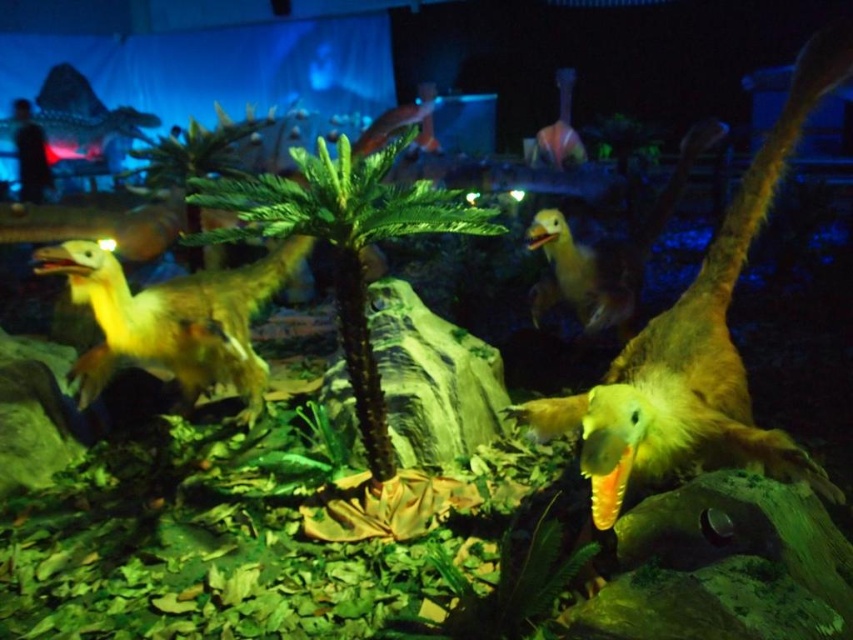
What do you see at coordinates (695, 344) in the screenshot?
I see `yellow matte dinosaur at center` at bounding box center [695, 344].

Does point (654, 387) come in front of point (180, 321)?

That is True.

Identify the location of yellow matte dinosaur at center. (695, 344).

Locate an element on the screen. The height and width of the screenshot is (640, 853). yellow matte dinosaur at center is located at coordinates (695, 344).

Does point (196, 237) come closer to viewer compared to point (125, 324)?

Yes, it is in front of point (125, 324).

You are a GUI agent. You are given a task and a screenshot of the screen. Output one action in this format:
    pyautogui.click(x=<x>, y=<y>)
    Task: Click on the green leafy palm tree at center
    This screenshot has width=853, height=640.
    Given the screenshot: What is the action you would take?
    [344, 243]

Who is higher up, yellow matte dinosaur at center or green leafy palm tree at center?

Positioned higher is green leafy palm tree at center.

Is yellow matte dinosaur at center thinner than green leafy palm tree at center?

Yes, yellow matte dinosaur at center is thinner than green leafy palm tree at center.

Is point (805, 80) in front of point (434, 208)?

Yes, point (805, 80) is closer to viewer.

The image size is (853, 640). Find the location of `yellow matte dinosaur at center`. yellow matte dinosaur at center is located at coordinates (695, 344).